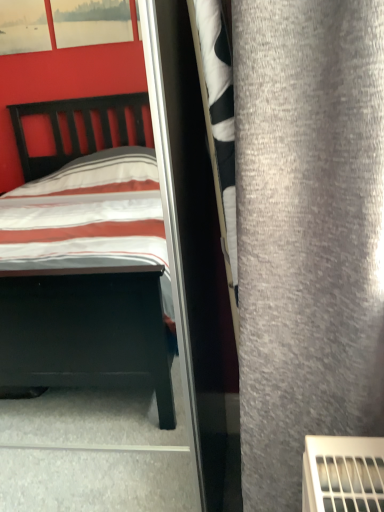
Question: Considering the relative sizes of gray fabric curtain at right and clear glass screen door at center in the image provided, is gray fabric curtain at right smaller than clear glass screen door at center?

Choices:
 (A) yes
 (B) no

Answer: (B)

Question: From a real-world perspective, does gray fabric curtain at right stand above clear glass screen door at center?

Choices:
 (A) no
 (B) yes

Answer: (B)

Question: Can you confirm if gray fabric curtain at right is wider than clear glass screen door at center?

Choices:
 (A) yes
 (B) no

Answer: (B)

Question: Is gray fabric curtain at right oriented towards clear glass screen door at center?

Choices:
 (A) no
 (B) yes

Answer: (B)

Question: Is gray fabric curtain at right touching clear glass screen door at center?

Choices:
 (A) yes
 (B) no

Answer: (B)

Question: Relative to striped fabric bed at left, is clear glass screen door at center in front or behind?

Choices:
 (A) behind
 (B) front

Answer: (A)

Question: Visually, is clear glass screen door at center positioned to the left or to the right of striped fabric bed at left?

Choices:
 (A) left
 (B) right

Answer: (B)

Question: From the image's perspective, is clear glass screen door at center positioned above or below striped fabric bed at left?

Choices:
 (A) below
 (B) above

Answer: (A)

Question: In terms of width, does clear glass screen door at center look wider or thinner when compared to striped fabric bed at left?

Choices:
 (A) wide
 (B) thin

Answer: (B)

Question: Considering the relative positions of clear glass screen door at center and gray fabric curtain at right in the image provided, is clear glass screen door at center to the left or to the right of gray fabric curtain at right?

Choices:
 (A) left
 (B) right

Answer: (A)

Question: In terms of width, does clear glass screen door at center look wider or thinner when compared to gray fabric curtain at right?

Choices:
 (A) wide
 (B) thin

Answer: (A)

Question: From the image's perspective, is clear glass screen door at center located above or below gray fabric curtain at right?

Choices:
 (A) below
 (B) above

Answer: (A)

Question: From a real-world perspective, relative to gray fabric curtain at right, is clear glass screen door at center vertically above or below?

Choices:
 (A) above
 (B) below

Answer: (B)

Question: From a real-world perspective, relative to striped fabric bed at left, is gray fabric curtain at right vertically above or below?

Choices:
 (A) below
 (B) above

Answer: (B)

Question: Is gray fabric curtain at right bigger or smaller than striped fabric bed at left?

Choices:
 (A) small
 (B) big

Answer: (A)